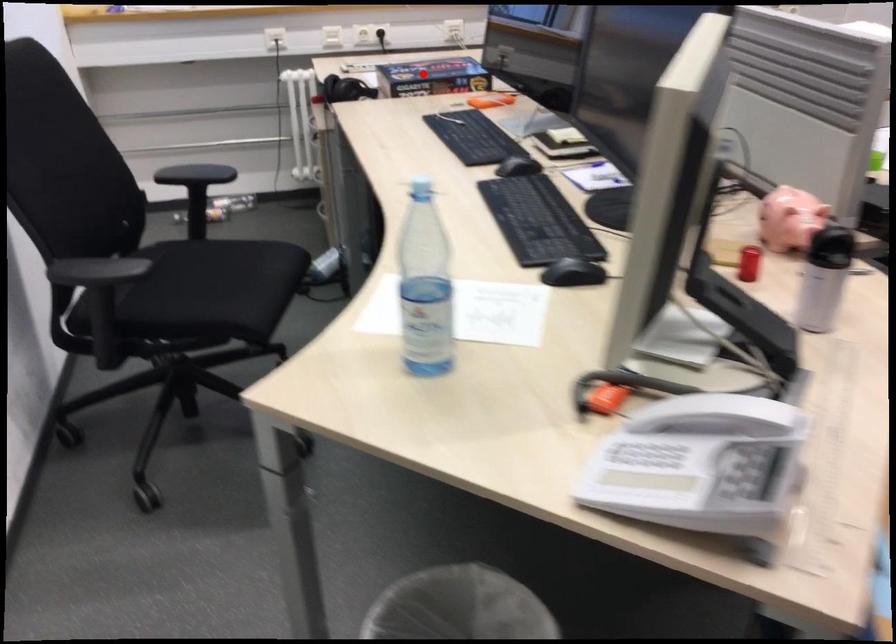
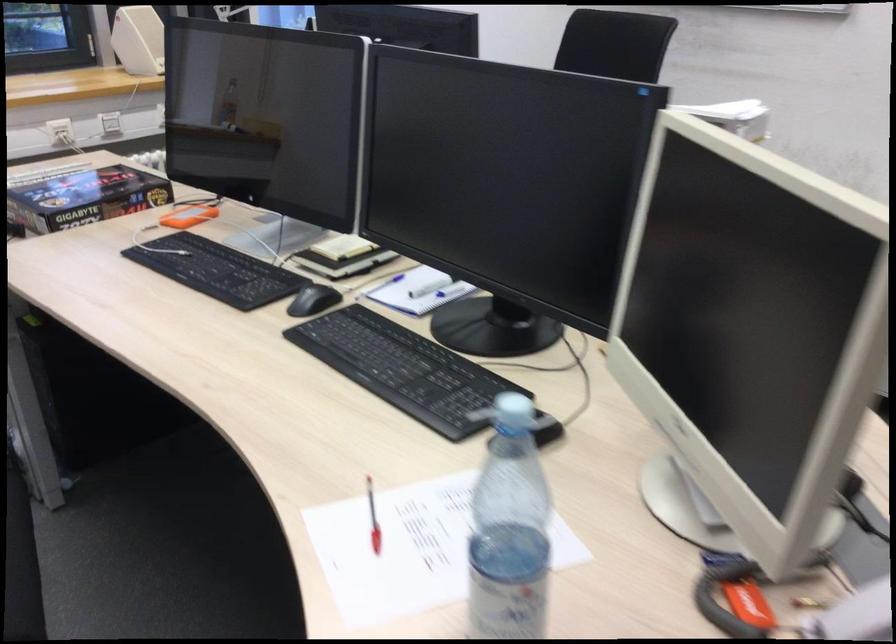
Locate, in the second image, the point that corresponds to the highlighted location in the first image.

(83, 198)